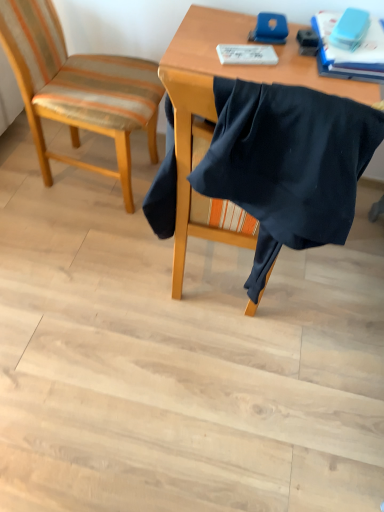
You are a GUI agent. You are given a task and a screenshot of the screen. Output one action in this format:
    pyautogui.click(x=<x>, y=<y>)
    Task: Click on the vacant area that is in front of white paper at upper center
    The height and width of the screenshot is (512, 384).
    Given the screenshot: What is the action you would take?
    pyautogui.click(x=256, y=69)